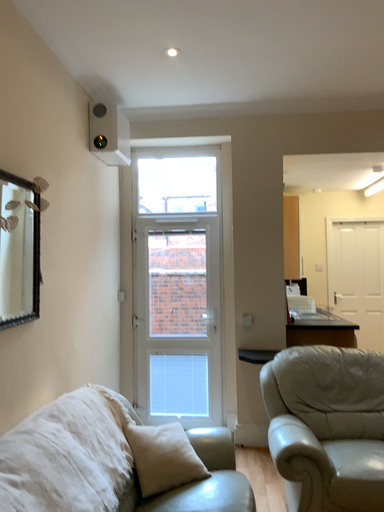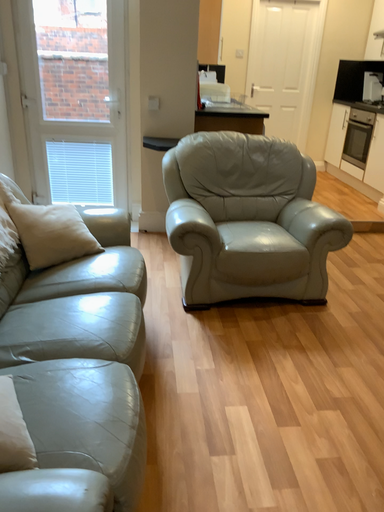
Question: How did the camera likely rotate when shooting the video?

Choices:
 (A) rotated upward
 (B) rotated downward

Answer: (B)